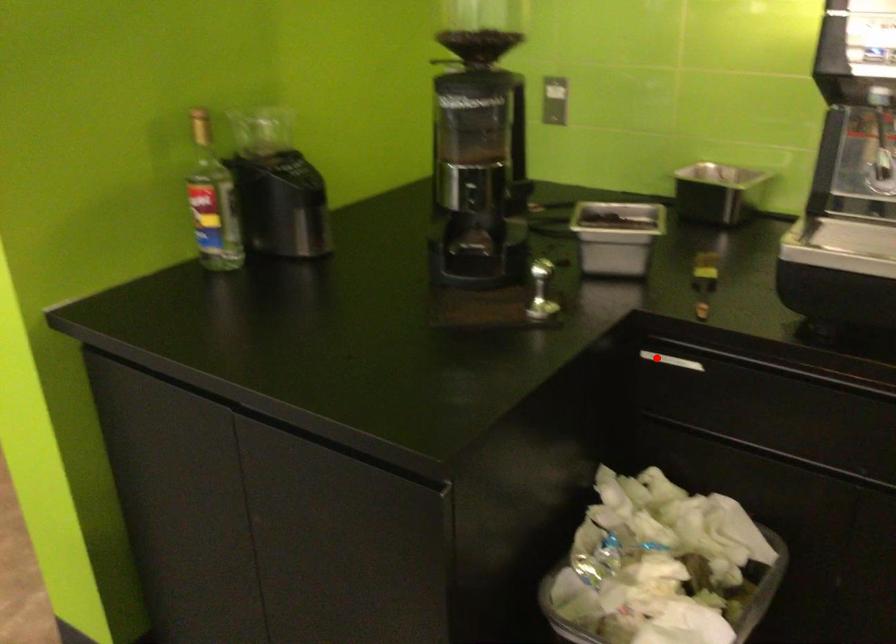
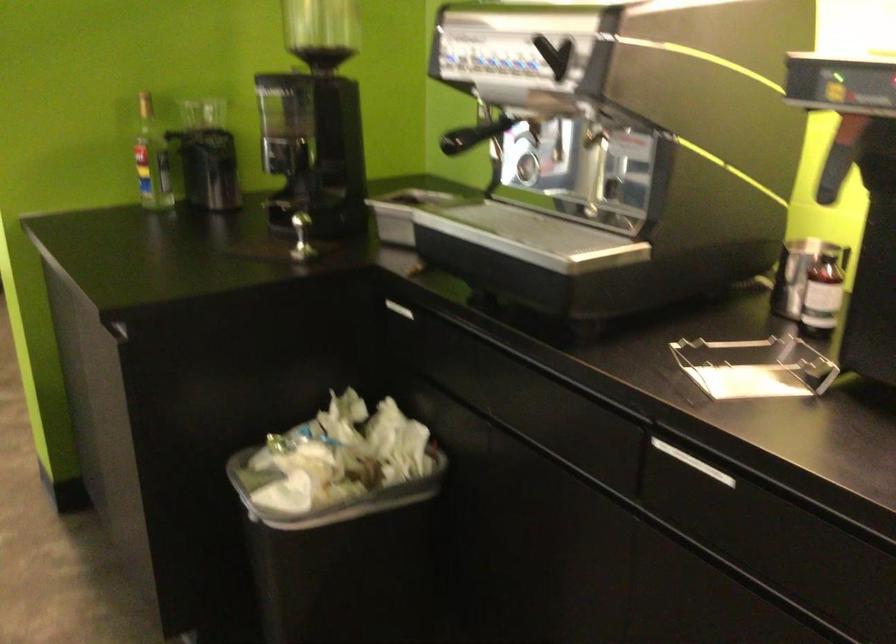
Question: I am providing you with two images of the same scene from different viewpoints. In image1, a red point is highlighted. Considering the same 3D point in image2, which of the following is correct?

Choices:
 (A) It is closer
 (B) It is farther

Answer: (B)